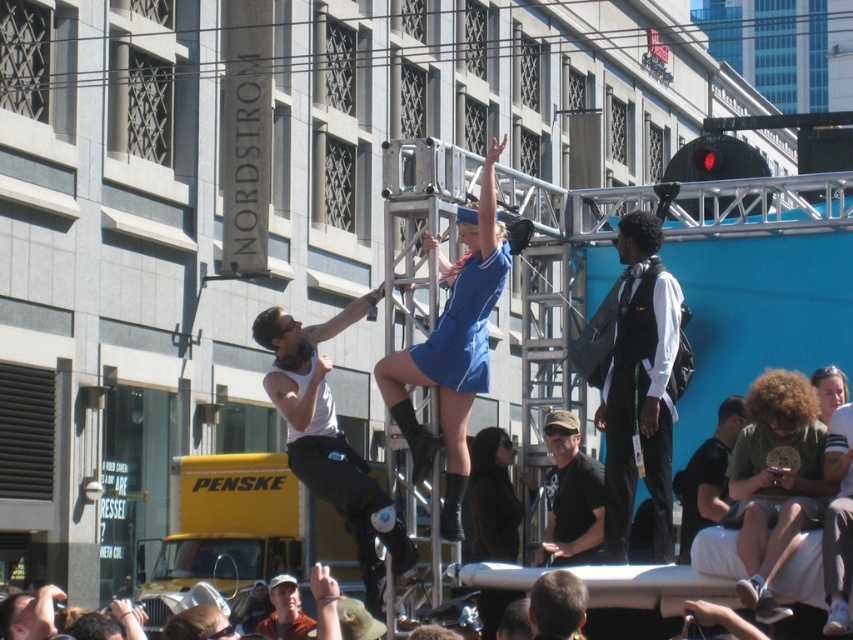
You are standing at the front of the crowd and want to take a photo of both the white shirt with black vest at center and the matte green shirt at lower right in the same frame. Given that your camera has a maximum focus range of 5 meters, can you capture both subjects clearly?

The white shirt with black vest at center is 5.50 meters away from the matte green shirt at lower right. Since the distance between them exceeds the camera maximum focus range of 5 meters, you cannot capture both subjects clearly in the same frame.

You are part of the crowd watching the performance. You notice two people in the crowd wearing a white matte tank top at center and a green fabric shirt at lower right. Which one is closer to the front of the crowd?

The white matte tank top at center is positioned on the left side of the green fabric shirt at lower right, so the white matte tank top at center is closer to the front of the crowd.